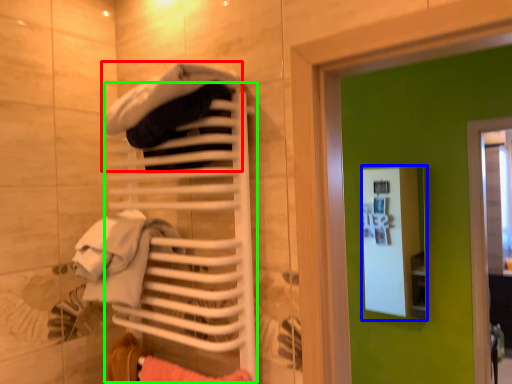
Question: Estimate the real-world distances between objects in this image. Which object is farther from clothing (highlighted by a red box), medicine cabinet (highlighted by a blue box) or closet (highlighted by a green box)?

Choices:
 (A) medicine cabinet
 (B) closet

Answer: (A)